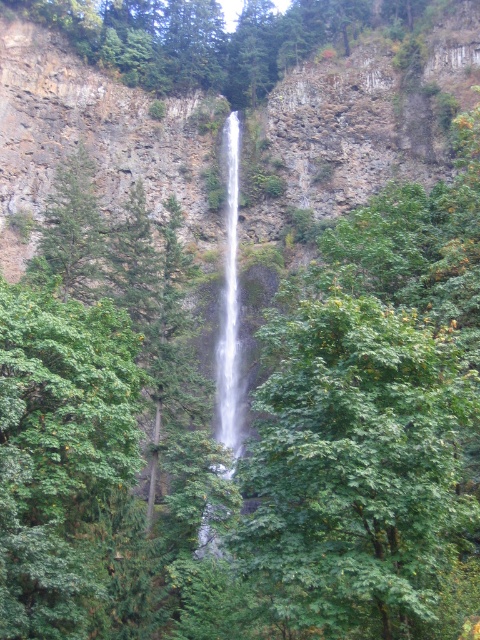
Question: Which point is farther to the camera?

Choices:
 (A) white smooth waterfall at center
 (B) clear water at center

Answer: (A)

Question: Can you confirm if clear water at center is bigger than white smooth waterfall at center?

Choices:
 (A) no
 (B) yes

Answer: (B)

Question: Which point appears farthest from the camera in this image?

Choices:
 (A) (200, 529)
 (B) (219, 440)

Answer: (B)

Question: Considering the relative positions of clear water at center and white smooth waterfall at center in the image provided, where is clear water at center located with respect to white smooth waterfall at center?

Choices:
 (A) right
 (B) left

Answer: (B)

Question: Is clear water at center closer to camera compared to white smooth waterfall at center?

Choices:
 (A) yes
 (B) no

Answer: (A)